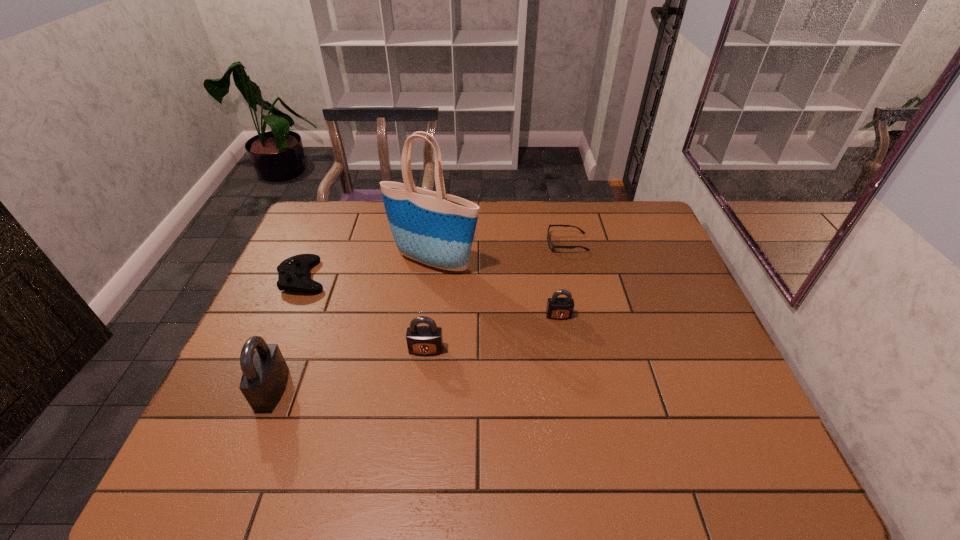
In order to click on the second tallest object in this screenshot , I will do `click(265, 373)`.

Image resolution: width=960 pixels, height=540 pixels. I want to click on the tallest padlock, so click(x=265, y=373).

Find the location of a particular element. the fourth shortest object is located at coordinates (421, 340).

Find the location of a particular element. This screenshot has width=960, height=540. the second padlock from left to right is located at coordinates (421, 340).

Locate an element on the screen. The height and width of the screenshot is (540, 960). the fourth farthest object is located at coordinates (558, 308).

In order to click on the fourth tallest object in this screenshot , I will do `click(558, 308)`.

This screenshot has height=540, width=960. Find the location of `tote bag`. tote bag is located at coordinates (434, 228).

This screenshot has width=960, height=540. I want to click on the shortest object, so click(x=550, y=244).

Image resolution: width=960 pixels, height=540 pixels. What are the coordinates of `control` in the screenshot? It's located at (293, 273).

Find the location of a particular element. vacant space located on the front of the second tallest padlock near the keyhole is located at coordinates (423, 373).